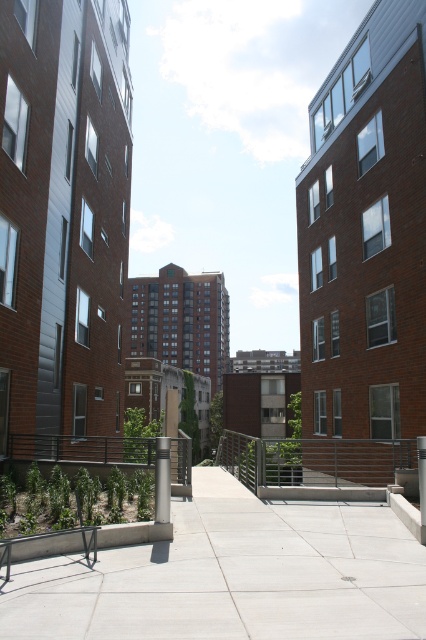
Question: Is gray concrete pavement at center to the right of satin silver post at center from the viewer's perspective?

Choices:
 (A) yes
 (B) no

Answer: (A)

Question: Which of these objects is positioned farthest from the satin silver post at center?

Choices:
 (A) metallic silver balustrade at center
 (B) gray concrete pavement at center

Answer: (A)

Question: Can you confirm if gray concrete pavement at center is positioned to the left of metallic silver balustrade at center?

Choices:
 (A) yes
 (B) no

Answer: (A)

Question: Which object is positioned farthest from the gray concrete pavement at center?

Choices:
 (A) metallic silver balustrade at center
 (B) satin silver post at center

Answer: (A)

Question: Is gray concrete pavement at center wider than metallic silver balustrade at center?

Choices:
 (A) yes
 (B) no

Answer: (B)

Question: Estimate the real-world distances between objects in this image. Which object is closer to the metallic silver balustrade at center?

Choices:
 (A) gray concrete pavement at center
 (B) satin silver post at center

Answer: (B)